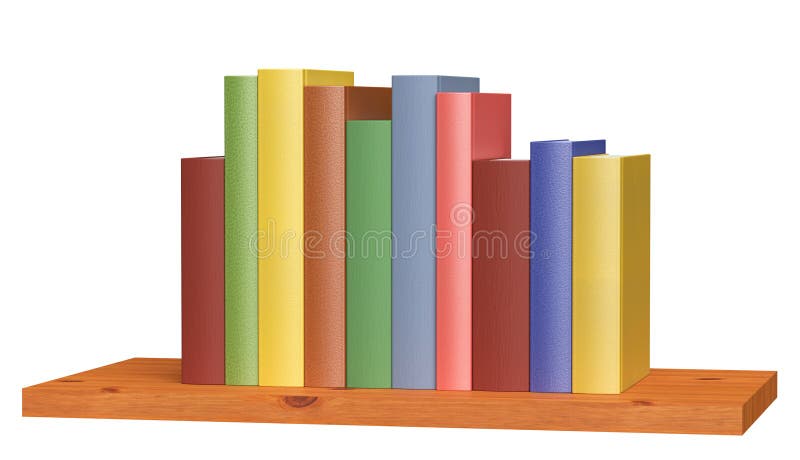
Where is `book spine`? The height and width of the screenshot is (460, 800). book spine is located at coordinates (594, 264), (562, 303), (508, 314), (446, 343), (414, 345), (366, 339), (326, 339), (288, 337), (240, 341), (213, 341).